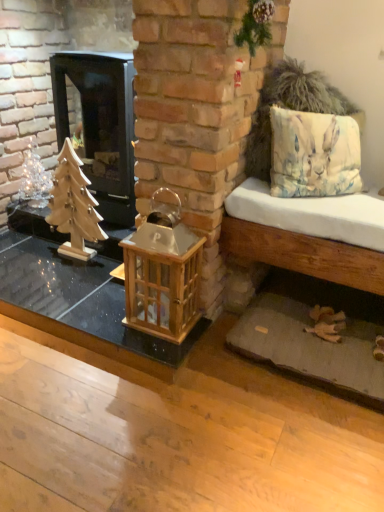
Question: From their relative heights in the image, would you say watercolor fabric pillow at right is taller or shorter than wooden lantern at center?

Choices:
 (A) short
 (B) tall

Answer: (A)

Question: Choose the correct answer: Is watercolor fabric pillow at right inside wooden lantern at center or outside it?

Choices:
 (A) inside
 (B) outside

Answer: (B)

Question: Estimate the real-world distances between objects in this image. Which object is farther from the wooden lantern at center?

Choices:
 (A) wooden table at center
 (B) wooden christmas tree at left
 (C) shiny silver christmas tree at left
 (D) light brown wooden bench at right
 (E) black glass wood burning stove at left

Answer: (C)

Question: Which is nearer to the wooden table at center?

Choices:
 (A) watercolor fabric pillow at right
 (B) wooden christmas tree at left
 (C) wooden lantern at center
 (D) black glass wood burning stove at left
 (E) shiny silver christmas tree at left

Answer: (C)